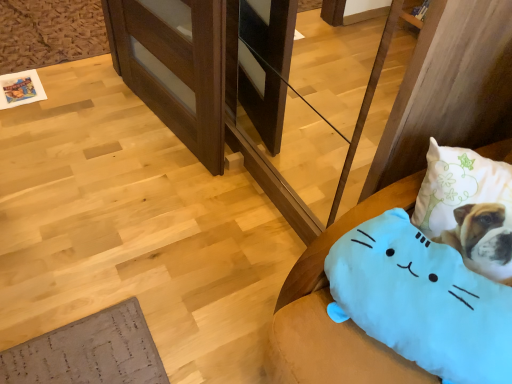
Find the location of a particular element. The height and width of the screenshot is (384, 512). vacant area that is in front of wooden at left is located at coordinates click(x=118, y=200).